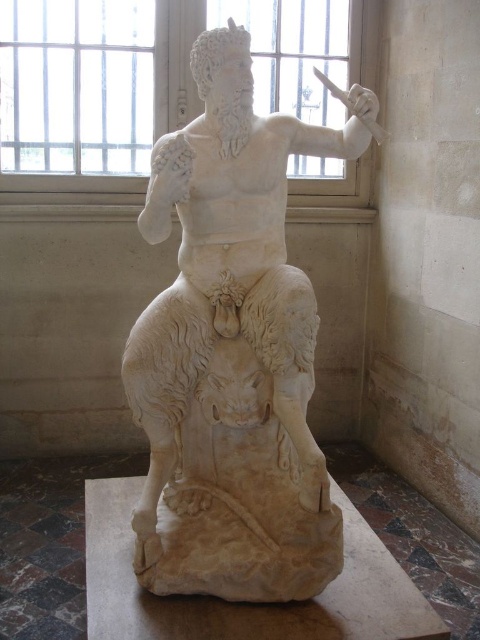
Which is in front, point (156, 352) or point (232, 10)?

Point (156, 352) is in front.

Is point (237, 344) less distant than point (264, 28)?

Yes, point (237, 344) is closer to viewer.

The width and height of the screenshot is (480, 640). Identify the location of white marble statue at center. (231, 348).